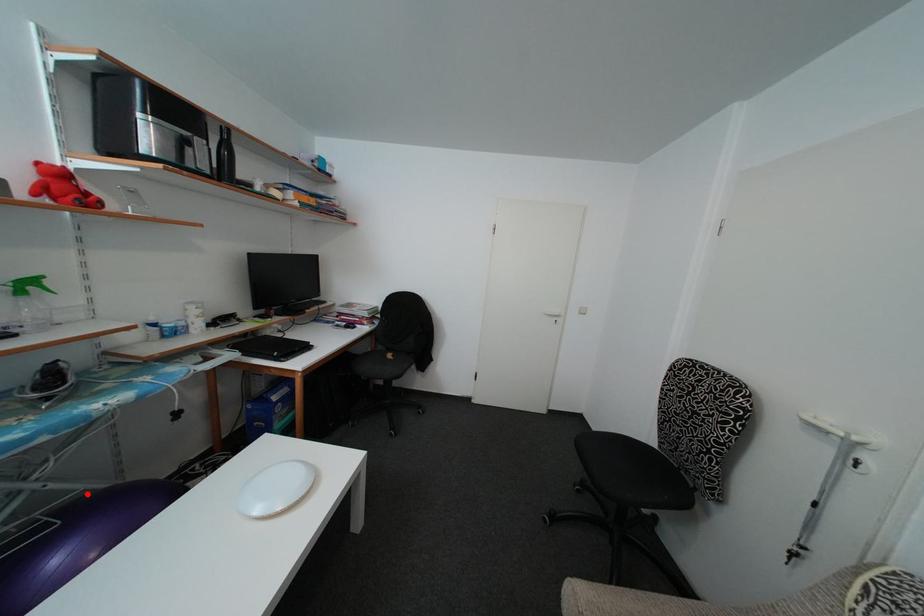
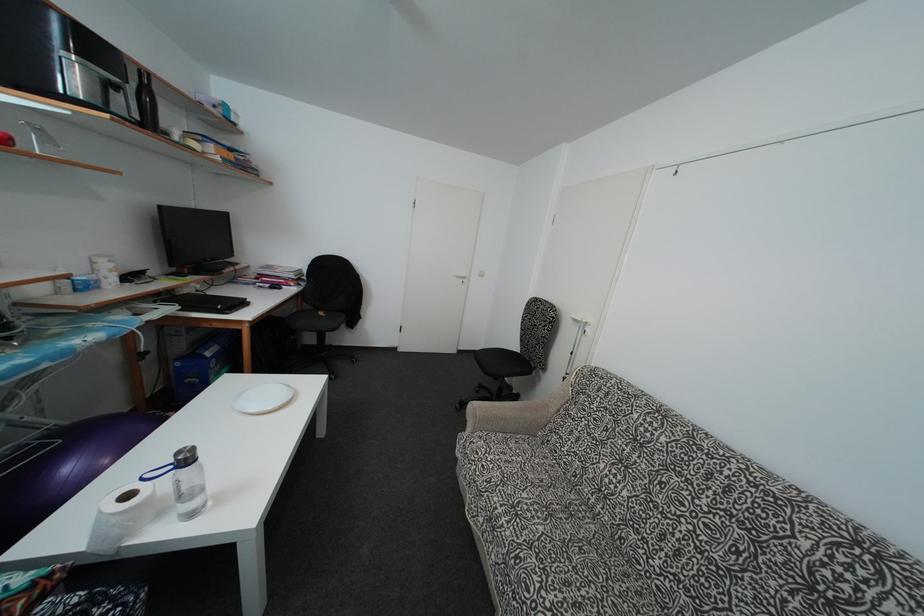
Where in the second image is the point corresponding to the highlighted location from the first image?

(58, 429)